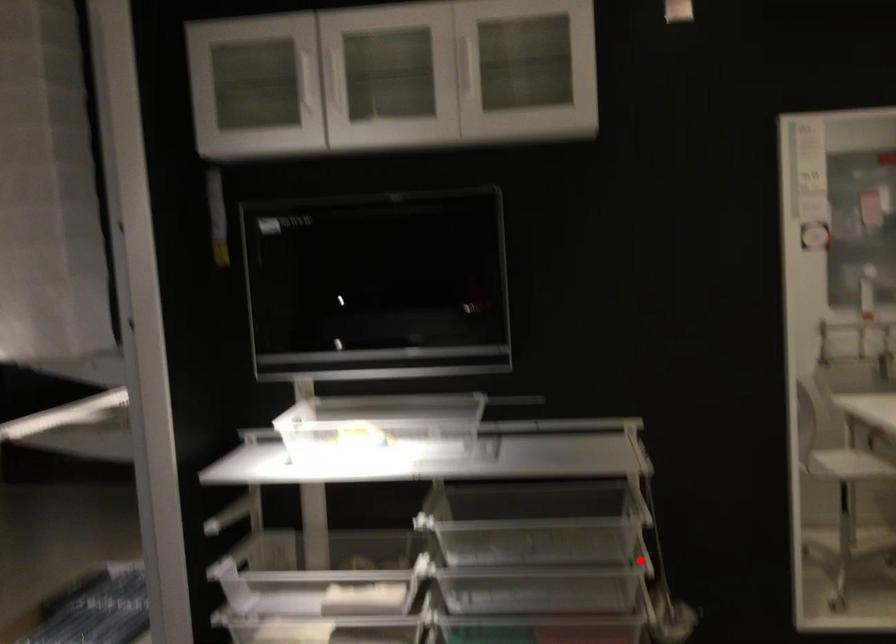
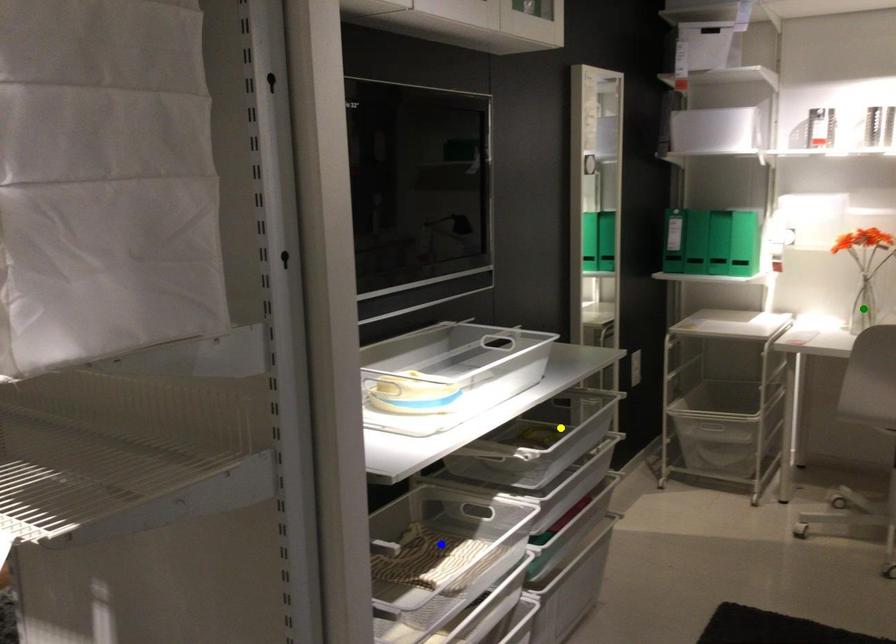
Question: I am providing you with two images of the same scene from different viewpoints. A red point is marked on the first image. You are given multiple points on the second image. Which point in image 2 represents the same 3d spot as the red point in image 1?

Choices:
 (A) green point
 (B) blue point
 (C) yellow point

Answer: (C)